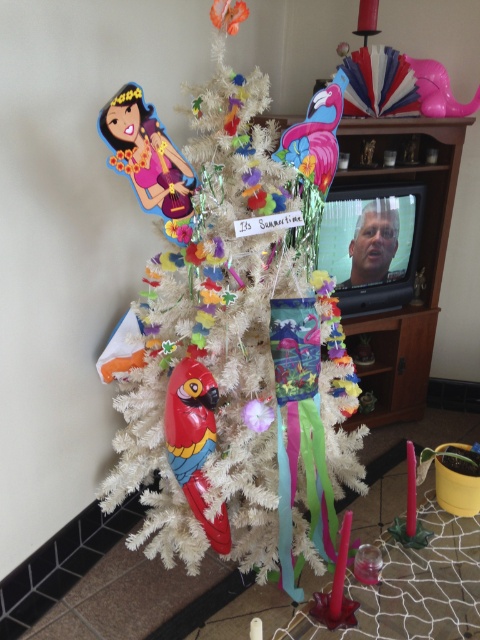
Between white artificial christmas tree at center and shiny plastic parrot at center, which one is positioned higher?

white artificial christmas tree at center

Who is taller, white artificial christmas tree at center or shiny plastic parrot at center?

white artificial christmas tree at center

Is point (216, 193) closer to camera compared to point (175, 384)?

Yes.

In order to click on white artificial christmas tree at center in this screenshot , I will do `click(232, 332)`.